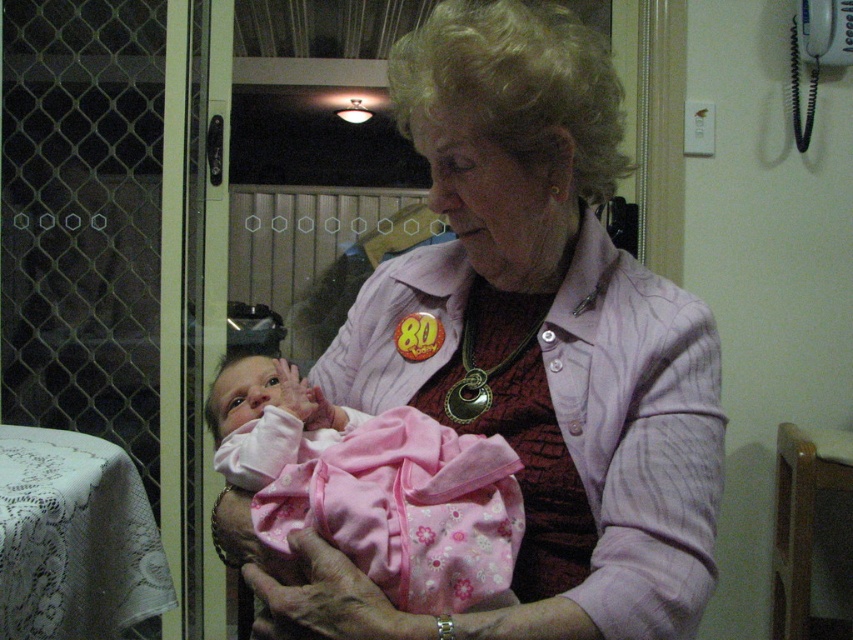
Question: From the image, what is the correct spatial relationship of pink fabric at center in relation to pink fleece baby at center?

Choices:
 (A) above
 (B) below

Answer: (A)

Question: Does pink fabric at center appear on the left side of pink fleece baby at center?

Choices:
 (A) no
 (B) yes

Answer: (A)

Question: Can you confirm if pink fabric at center is wider than pink fleece baby at center?

Choices:
 (A) no
 (B) yes

Answer: (B)

Question: Which point is farther to the camera?

Choices:
 (A) (482, 124)
 (B) (495, 577)

Answer: (A)

Question: Which object is closer to the camera taking this photo?

Choices:
 (A) pink fabric at center
 (B) pink fleece baby at center

Answer: (A)